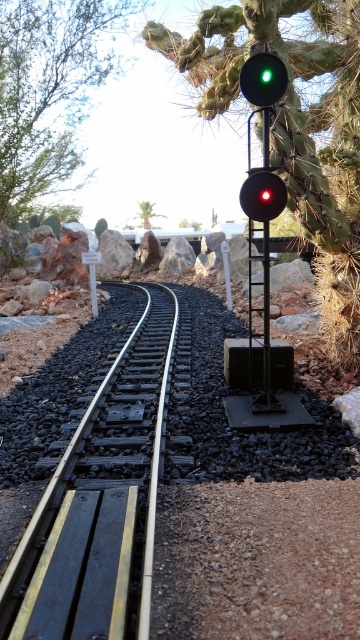
Can you confirm if green glass traffic light at upper center is bigger than matte black traffic light at upper center?

No.

Between point (254, 104) and point (261, 200), which one is positioned behind?

The point (261, 200) is behind.

Find the location of `green glass traffic light at upper center`. green glass traffic light at upper center is located at coordinates coord(263,77).

Is black metal train track at left further to camera compared to matte black traffic light at upper center?

No, it is in front of matte black traffic light at upper center.

Does black metal train track at left have a greater height compared to matte black traffic light at upper center?

Yes.

Does point (99, 458) come farther from viewer compared to point (270, 180)?

That is False.

Image resolution: width=360 pixels, height=640 pixels. In order to click on black metal train track at left in this screenshot , I will do `click(101, 502)`.

What do you see at coordinates (101, 502) in the screenshot? I see `black metal train track at left` at bounding box center [101, 502].

Does black metal train track at left have a larger size compared to green glass traffic light at upper center?

Yes, black metal train track at left is bigger than green glass traffic light at upper center.

Who is more forward, [123,625] or [249,68]?

Point [123,625] is more forward.

The image size is (360, 640). Identify the location of black metal train track at left. (101, 502).